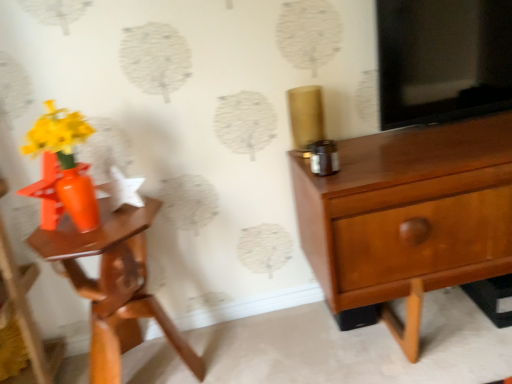
Question: From the image's perspective, is orange glossy vase at left under matte orange nightstand at left?

Choices:
 (A) no
 (B) yes

Answer: (A)

Question: Is orange glossy vase at left wider than matte orange nightstand at left?

Choices:
 (A) yes
 (B) no

Answer: (B)

Question: Does orange glossy vase at left have a smaller size compared to matte orange nightstand at left?

Choices:
 (A) yes
 (B) no

Answer: (A)

Question: Is orange glossy vase at left closer to camera compared to matte orange nightstand at left?

Choices:
 (A) no
 (B) yes

Answer: (A)

Question: Is orange glossy vase at left at the left side of matte orange nightstand at left?

Choices:
 (A) yes
 (B) no

Answer: (A)

Question: Is orange glossy vase at left wider or thinner than matte wood chest of drawers at right?

Choices:
 (A) thin
 (B) wide

Answer: (A)

Question: Considering the positions of orange glossy vase at left and matte wood chest of drawers at right in the image, is orange glossy vase at left taller or shorter than matte wood chest of drawers at right?

Choices:
 (A) short
 (B) tall

Answer: (A)

Question: From a real-world perspective, is orange glossy vase at left physically located above or below matte wood chest of drawers at right?

Choices:
 (A) above
 (B) below

Answer: (A)

Question: Is orange glossy vase at left bigger or smaller than matte wood chest of drawers at right?

Choices:
 (A) big
 (B) small

Answer: (B)

Question: Considering their positions, is orange glossy vase at left located in front of or behind matte orange nightstand at left?

Choices:
 (A) front
 (B) behind

Answer: (B)

Question: In terms of height, does orange glossy vase at left look taller or shorter compared to matte orange nightstand at left?

Choices:
 (A) short
 (B) tall

Answer: (A)

Question: Is orange glossy vase at left inside the boundaries of matte orange nightstand at left, or outside?

Choices:
 (A) inside
 (B) outside

Answer: (B)

Question: Is orange glossy vase at left bigger or smaller than matte orange nightstand at left?

Choices:
 (A) big
 (B) small

Answer: (B)

Question: Considering the positions of matte wood chest of drawers at right and matte orange nightstand at left in the image, is matte wood chest of drawers at right wider or thinner than matte orange nightstand at left?

Choices:
 (A) thin
 (B) wide

Answer: (B)

Question: Would you say matte wood chest of drawers at right is inside or outside matte orange nightstand at left?

Choices:
 (A) outside
 (B) inside

Answer: (A)